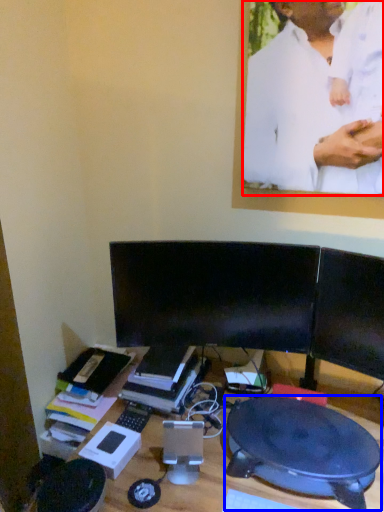
Question: Among these objects, which one is nearest to the camera, man (highlighted by a red box) or round table (highlighted by a blue box)?

Choices:
 (A) man
 (B) round table

Answer: (B)